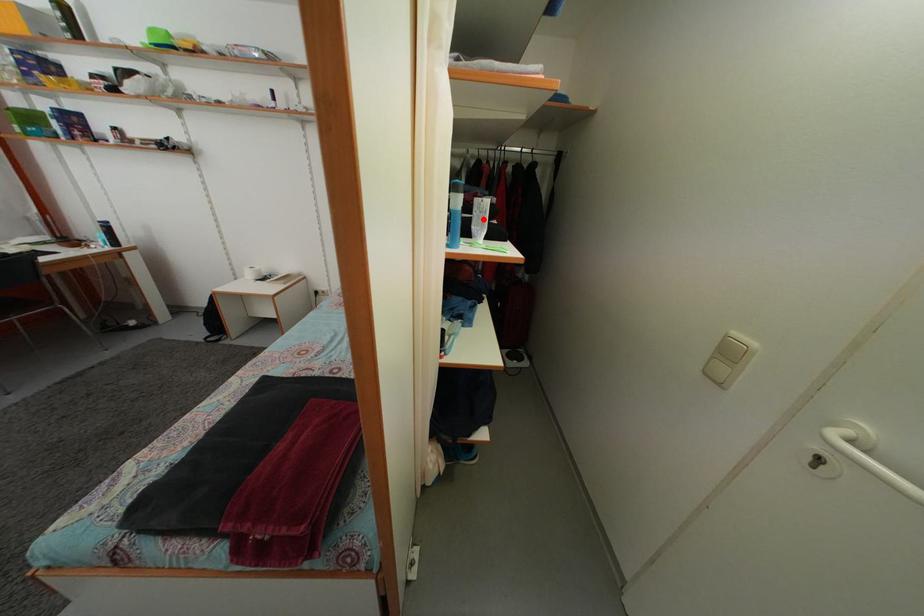
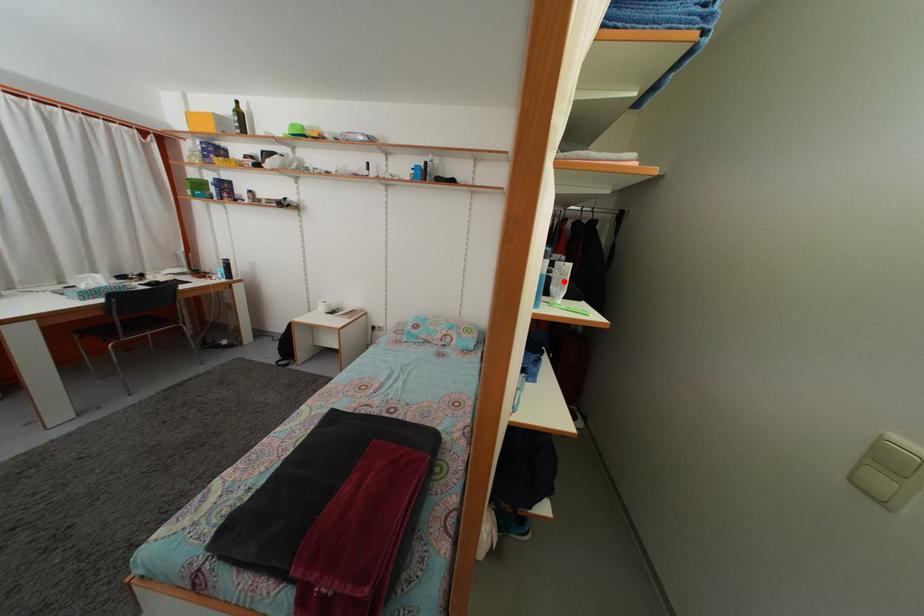
I am providing you with two images of the same scene from different viewpoints. A red point is marked on the first image and another point is marked on the second image. Are the points marked in image1 and image2 representing the same 3D position?

Yes